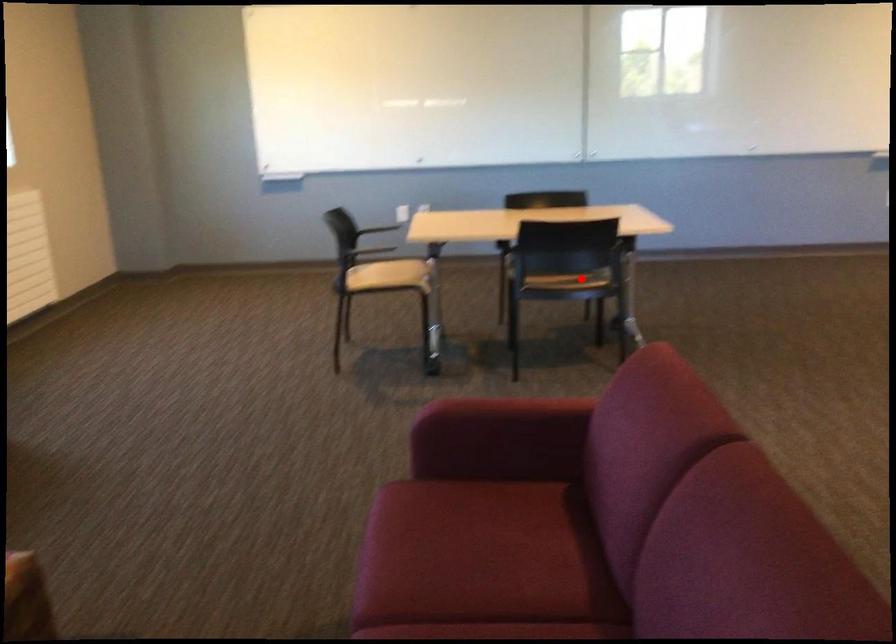
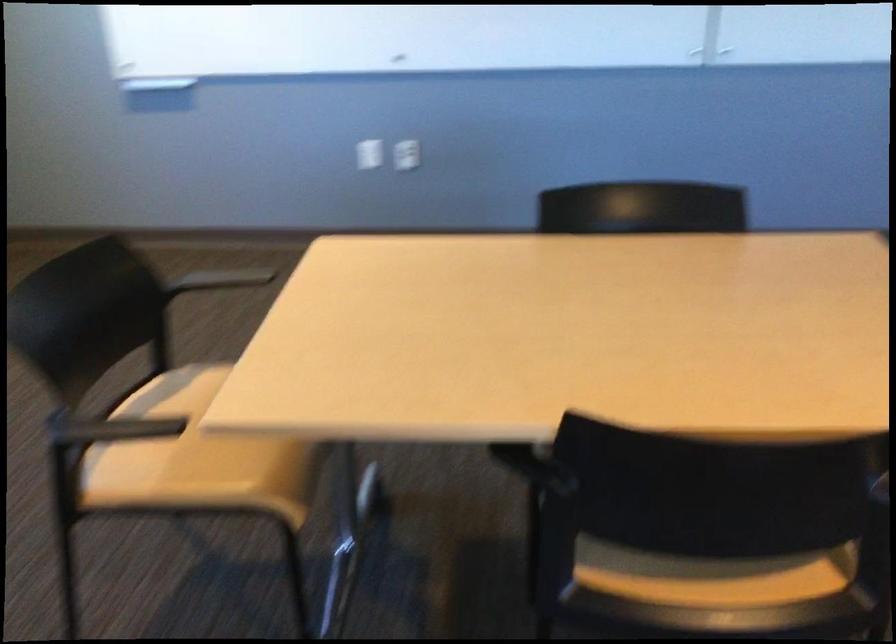
Question: I am providing you with two images of the same scene from different viewpoints. A red point is marked on the first image. Is the red point's position out of view in image 2?

Choices:
 (A) Yes
 (B) No

Answer: (B)